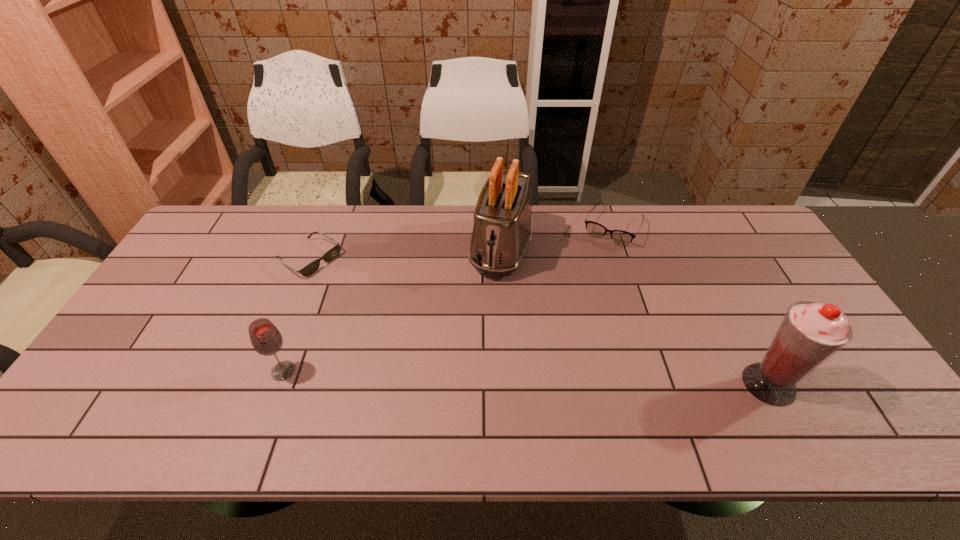
Locate an element on the screen. The width and height of the screenshot is (960, 540). free space on the desktop that is between the glass drink container and the rightmost object and is positioned on the side of the third object from left to right with the control lever is located at coordinates (458, 376).

Image resolution: width=960 pixels, height=540 pixels. Identify the location of free space on the desktop that is between the glass drink container and the smoothie and is positioned on the face of the spectacles. (533, 378).

At what (x,y) coordinates should I click in order to perform the action: click on vacant space on the desktop that is between the glass drink container and the rightmost object and is positioned on the front-facing side of the sunglasses. Please return your answer as a coordinate pair (x, y). The width and height of the screenshot is (960, 540). Looking at the image, I should click on (502, 377).